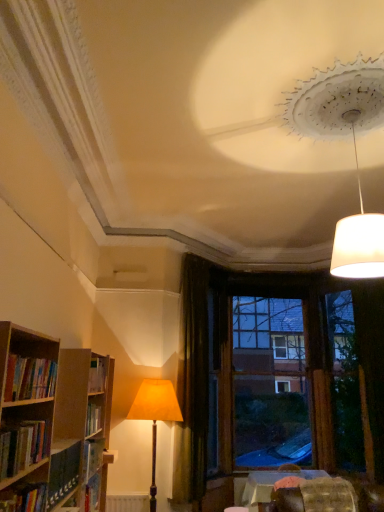
Question: From the image's perspective, is matte orange fabric lampshade at center, which is the first lamp in back-to-front order, located above or below hardcover books at left, arranged as the 3th book when ordered from the bottom?

Choices:
 (A) below
 (B) above

Answer: (A)

Question: Is matte orange fabric lampshade at center, which is counted as the second lamp, starting from the front, inside the boundaries of hardcover books at left, arranged as the 3th book when ordered from the bottom, or outside?

Choices:
 (A) inside
 (B) outside

Answer: (B)

Question: Which object is positioned farthest from the wooden textured table at lower center?

Choices:
 (A) brown wooden window frame at center
 (B) dark velvet curtain at center
 (C) hardcover book at lower left, which ranks as the 1th book in bottom-to-top order
 (D) hardcover books at left, arranged as the 3th book when ordered from the bottom
 (E) matte orange fabric lampshade at center, which is counted as the second lamp, starting from the front

Answer: (D)

Question: Which object is positioned farthest from the dark velvet curtain at center?

Choices:
 (A) hardcover books at left, arranged as the 3th book when ordered from the bottom
 (B) wooden textured table at lower center
 (C) brown wooden window frame at center
 (D) hardcover book at lower left, positioned as the third book in top-to-bottom order
 (E) white matte lampshade at upper right, the 1th lamp positioned from the right

Answer: (E)